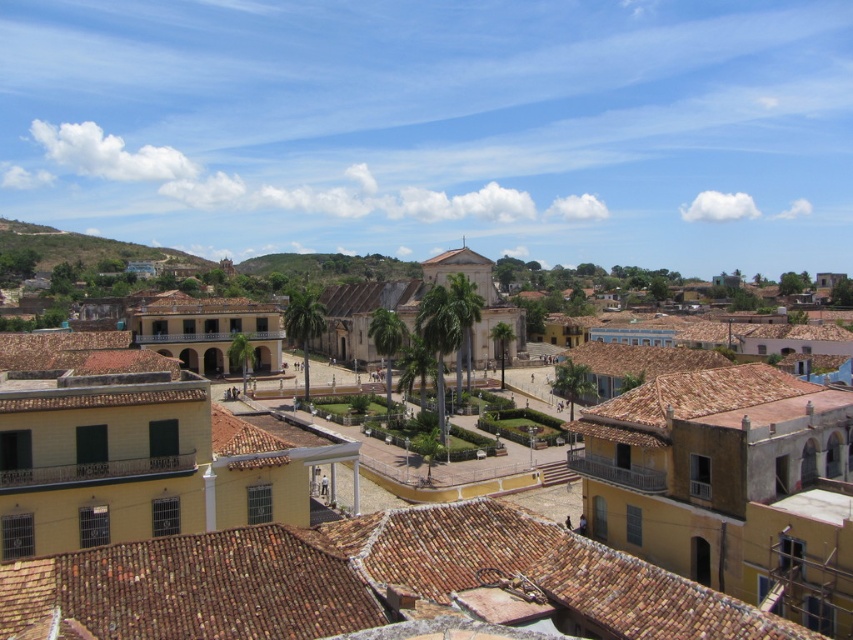
Who is taller, brown tile roof at lower center or green grassy hillside at upper left?

With more height is green grassy hillside at upper left.

Is brown tile roof at lower center to the right of green grassy hillside at upper left from the viewer's perspective?

Yes, brown tile roof at lower center is to the right of green grassy hillside at upper left.

Is point (148, 616) positioned behind point (26, 241)?

That is False.

The image size is (853, 640). What are the coordinates of `brown tile roof at lower center` in the screenshot? It's located at (372, 584).

Which is behind, point (33, 403) or point (102, 248)?

The point (102, 248) is behind.

Can you confirm if yellow clay roof tiles at center is taller than green grassy hillside at upper left?

No, yellow clay roof tiles at center is not taller than green grassy hillside at upper left.

Identify the location of yellow clay roof tiles at center. (399, 582).

What are the coordinates of `yellow clay roof tiles at center` in the screenshot? It's located at (399, 582).

Is yellow clay roof tiles at center to the right of brown tile roof at lower center from the viewer's perspective?

Indeed, yellow clay roof tiles at center is positioned on the right side of brown tile roof at lower center.

Between point (605, 588) and point (558, 616), which one is positioned in front?

Point (558, 616) is in front.

Does point (747, 448) come behind point (654, 579)?

That is True.

The image size is (853, 640). Find the location of `yellow clay roof tiles at center`. yellow clay roof tiles at center is located at coordinates (399, 582).